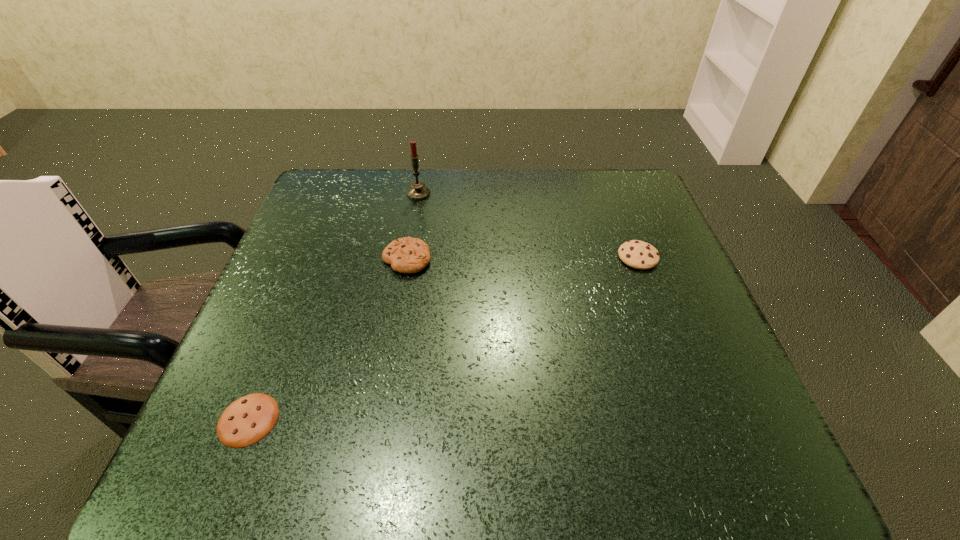
Locate an element on the screen. This screenshot has height=540, width=960. the farthest object is located at coordinates (418, 191).

The width and height of the screenshot is (960, 540). Find the location of `the tallest object`. the tallest object is located at coordinates (418, 191).

Where is `the second cookie from left to right`? the second cookie from left to right is located at coordinates (406, 255).

I want to click on the rightmost cookie, so click(637, 254).

Where is `the leftmost object`? the leftmost object is located at coordinates (247, 420).

Find the location of a particular element. This screenshot has height=540, width=960. the leftmost cookie is located at coordinates (247, 420).

I want to click on vacant space situated 0.070m on the front of the candle, so click(x=415, y=217).

At what (x,y) coordinates should I click in order to perform the action: click on free space located on the right of the second cookie from left to right. Please return your answer as a coordinate pair (x, y). This screenshot has width=960, height=540. Looking at the image, I should click on (453, 259).

In order to click on vacant point located 0.360m on the left of the rightmost object in this screenshot , I will do `click(463, 257)`.

Locate an element on the screen. Image resolution: width=960 pixels, height=540 pixels. free space located on the back of the shortest cookie is located at coordinates (318, 245).